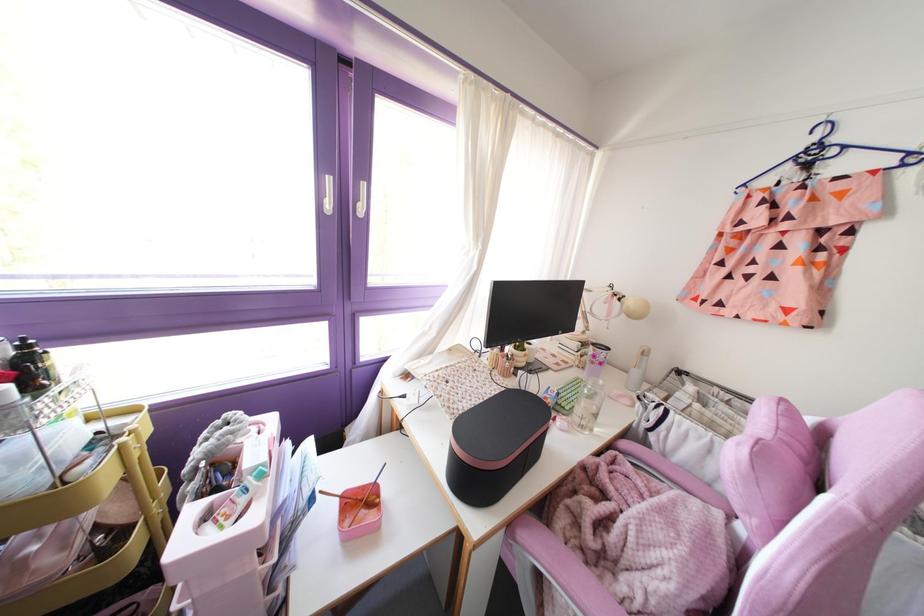
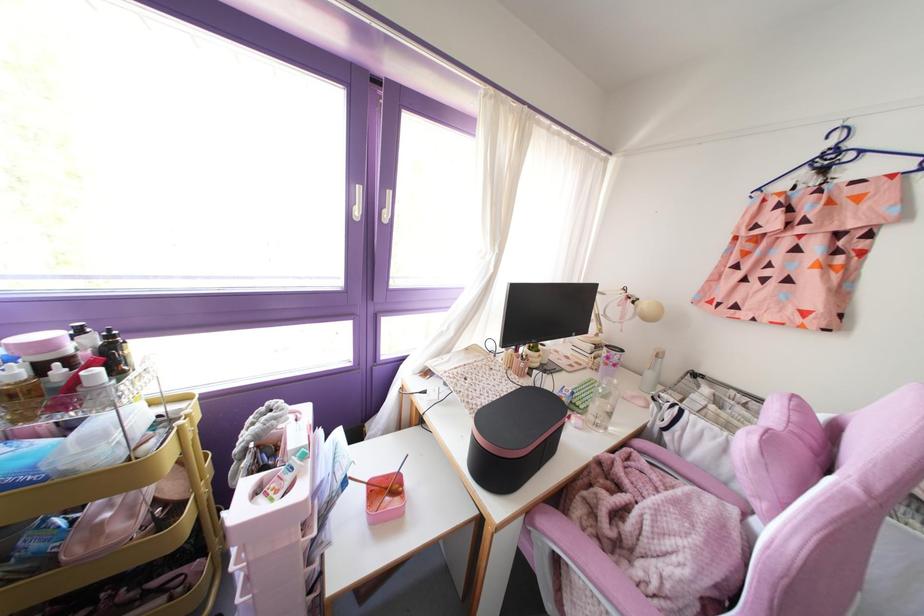
Where in the second image is the point corresponding to the point at 816,138 from the first image?

(832, 143)